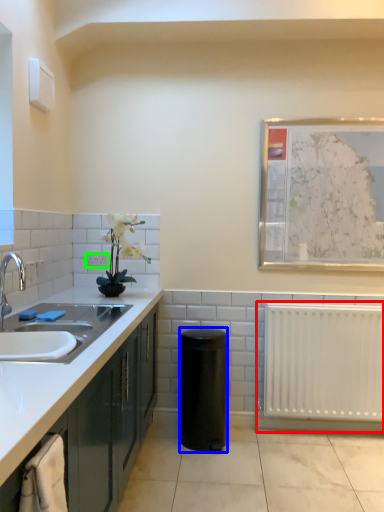
Question: Which object is the closest to the radiator (highlighted by a red box)? Choose among these: appliance (highlighted by a blue box) or electric outlet (highlighted by a green box).

Choices:
 (A) appliance
 (B) electric outlet

Answer: (A)